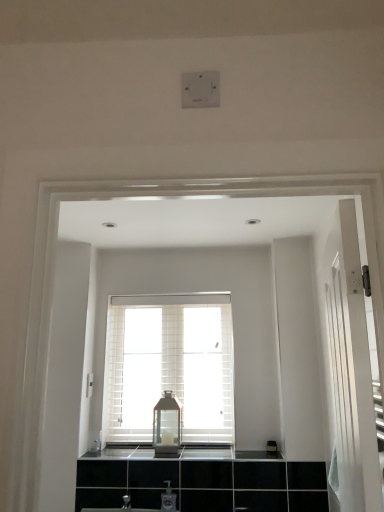
Image resolution: width=384 pixels, height=512 pixels. In order to click on free location to the right of matte glass lantern at center in this screenshot , I will do `click(190, 447)`.